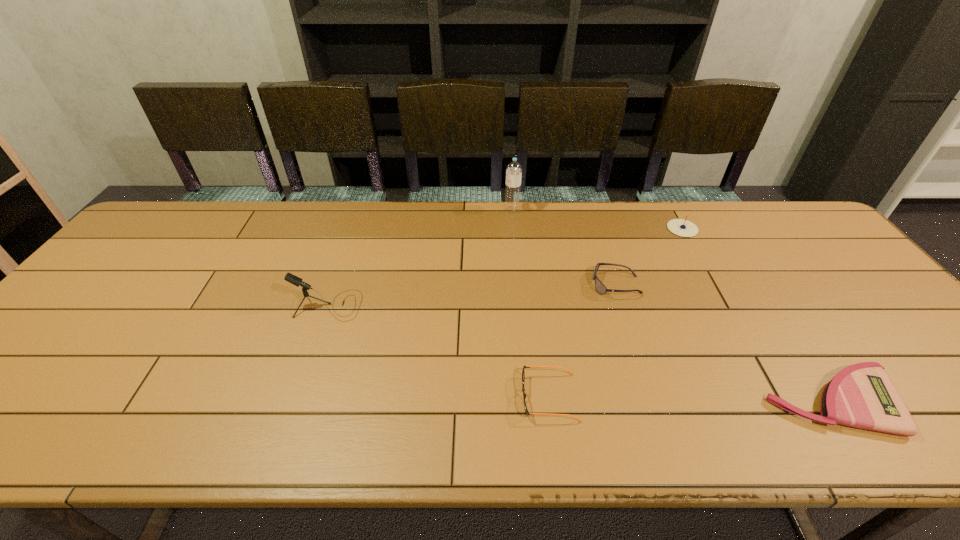
I want to click on vacant area located 0.130m on the front of the farthest object, so click(x=515, y=238).

You are a GUI agent. You are given a task and a screenshot of the screen. Output one action in this format:
    pyautogui.click(x=<x>, y=<y>)
    Task: Click on the blank area located 0.290m on the stand of the leftmost object
    
    Given the screenshot: What is the action you would take?
    pyautogui.click(x=471, y=305)

Locate an element on the screen. The image size is (960, 540). vacant space situated 0.260m on the front of the third tallest object is located at coordinates (721, 298).

Locate an element on the screen. vacant region located 0.130m on the lenses of the fourth object from left to right is located at coordinates (545, 285).

Where is `free space located on the lenses of the fourth object from left to right`? free space located on the lenses of the fourth object from left to right is located at coordinates 520,285.

What are the coordinates of `free location located on the lenses of the fourth object from left to right` in the screenshot? It's located at (535, 285).

You are a GUI agent. You are given a task and a screenshot of the screen. Output one action in this format:
    pyautogui.click(x=<x>, y=<y>)
    Task: Click on the vacant region located on the left of the wristlet
    
    Given the screenshot: What is the action you would take?
    (x=588, y=402)

The image size is (960, 540). In order to click on vacant area situated on the front-facing side of the spectacles in this screenshot , I will do `click(434, 397)`.

Locate an element on the screen. vacant region located on the front-facing side of the spectacles is located at coordinates (434, 397).

Where is `free space located 0.360m on the front-facing side of the spectacles`? The width and height of the screenshot is (960, 540). free space located 0.360m on the front-facing side of the spectacles is located at coordinates (355, 397).